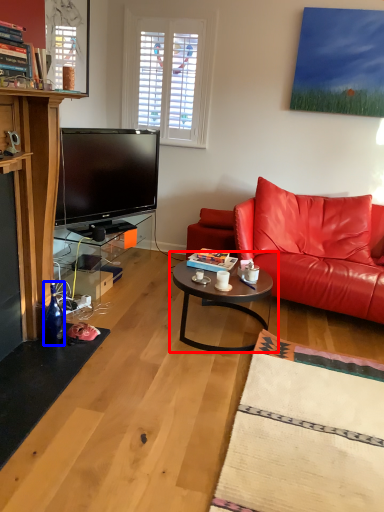
Question: Which object is closer to the camera taking this photo, coffee table (highlighted by a red box) or bottle (highlighted by a blue box)?

Choices:
 (A) coffee table
 (B) bottle

Answer: (B)